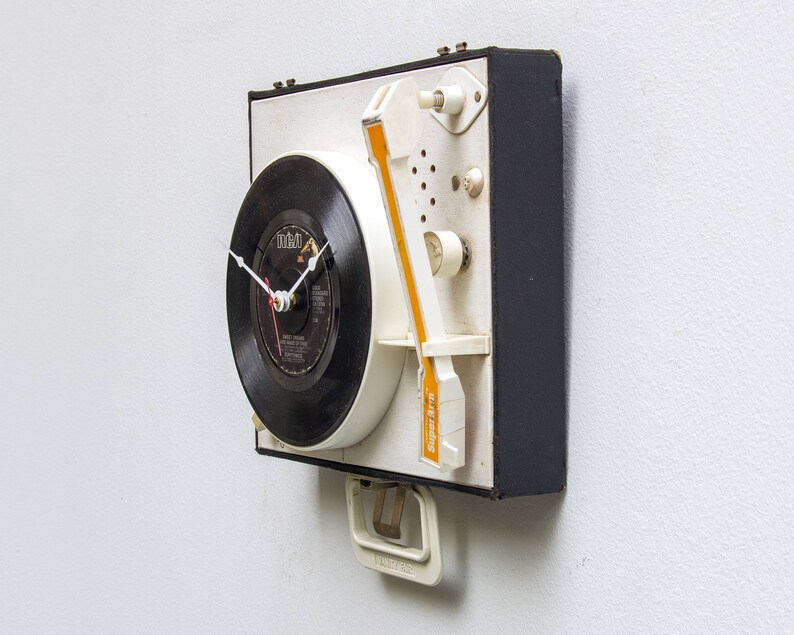
Find the location of a particular element. hinge is located at coordinates (282, 86), (449, 47).